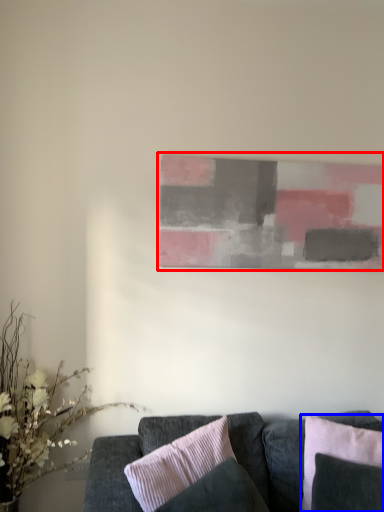
Question: Which point is closer to the camera, picture frame (highlighted by a red box) or pillow (highlighted by a blue box)?

Choices:
 (A) picture frame
 (B) pillow

Answer: (B)